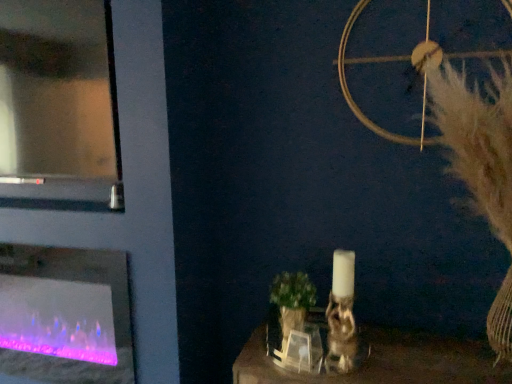
Question: Considering the relative sizes of translucent glass fireplace at left and white fluffy feather at upper right in the image provided, is translucent glass fireplace at left wider than white fluffy feather at upper right?

Choices:
 (A) yes
 (B) no

Answer: (B)

Question: Considering the relative positions of translucent glass fireplace at left and white fluffy feather at upper right in the image provided, is translucent glass fireplace at left behind white fluffy feather at upper right?

Choices:
 (A) no
 (B) yes

Answer: (B)

Question: From a real-world perspective, is translucent glass fireplace at left positioned under white fluffy feather at upper right based on gravity?

Choices:
 (A) no
 (B) yes

Answer: (B)

Question: From the image's perspective, does translucent glass fireplace at left appear higher than white fluffy feather at upper right?

Choices:
 (A) yes
 (B) no

Answer: (B)

Question: Does translucent glass fireplace at left have a smaller size compared to white fluffy feather at upper right?

Choices:
 (A) no
 (B) yes

Answer: (B)

Question: Does translucent glass fireplace at left have a greater height compared to white fluffy feather at upper right?

Choices:
 (A) yes
 (B) no

Answer: (B)

Question: From the image's perspective, is transparent glass door at upper left located beneath translucent glass fireplace at left?

Choices:
 (A) yes
 (B) no

Answer: (B)

Question: Is transparent glass door at upper left at the left side of translucent glass fireplace at left?

Choices:
 (A) yes
 (B) no

Answer: (A)

Question: Does transparent glass door at upper left lie behind translucent glass fireplace at left?

Choices:
 (A) no
 (B) yes

Answer: (A)

Question: Does transparent glass door at upper left have a smaller size compared to translucent glass fireplace at left?

Choices:
 (A) yes
 (B) no

Answer: (B)

Question: Is transparent glass door at upper left bigger than translucent glass fireplace at left?

Choices:
 (A) yes
 (B) no

Answer: (A)

Question: Can you confirm if transparent glass door at upper left is taller than translucent glass fireplace at left?

Choices:
 (A) yes
 (B) no

Answer: (A)

Question: Considering the relative sizes of translucent glass fireplace at left and transparent glass door at upper left in the image provided, is translucent glass fireplace at left taller than transparent glass door at upper left?

Choices:
 (A) no
 (B) yes

Answer: (A)